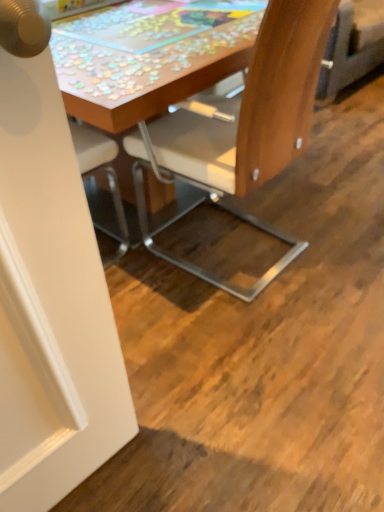
Locate an element on the screen. The height and width of the screenshot is (512, 384). wooden chair at center is located at coordinates (242, 127).

This screenshot has height=512, width=384. Describe the element at coordinates (242, 127) in the screenshot. I see `wooden chair at center` at that location.

The height and width of the screenshot is (512, 384). I want to click on wooden chair at center, so click(x=242, y=127).